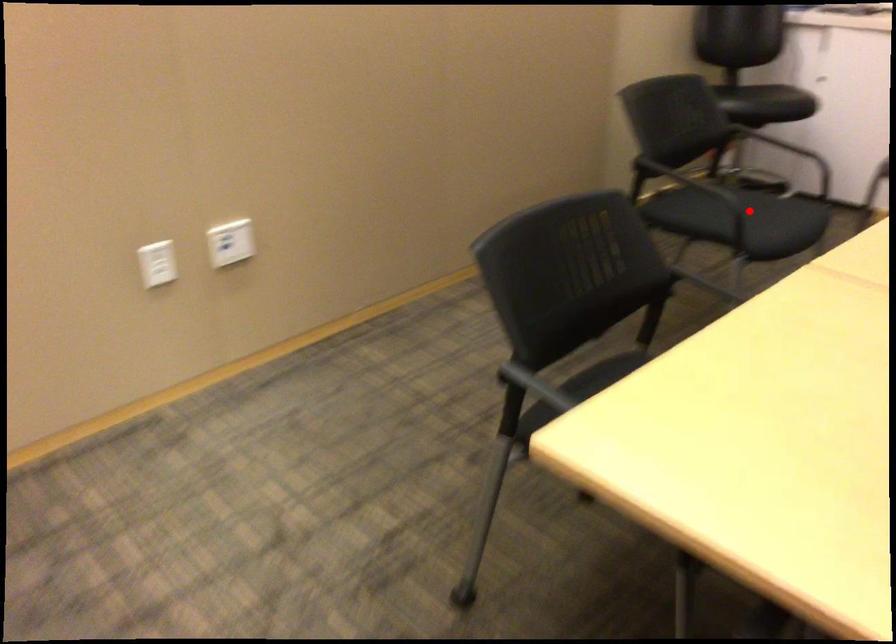
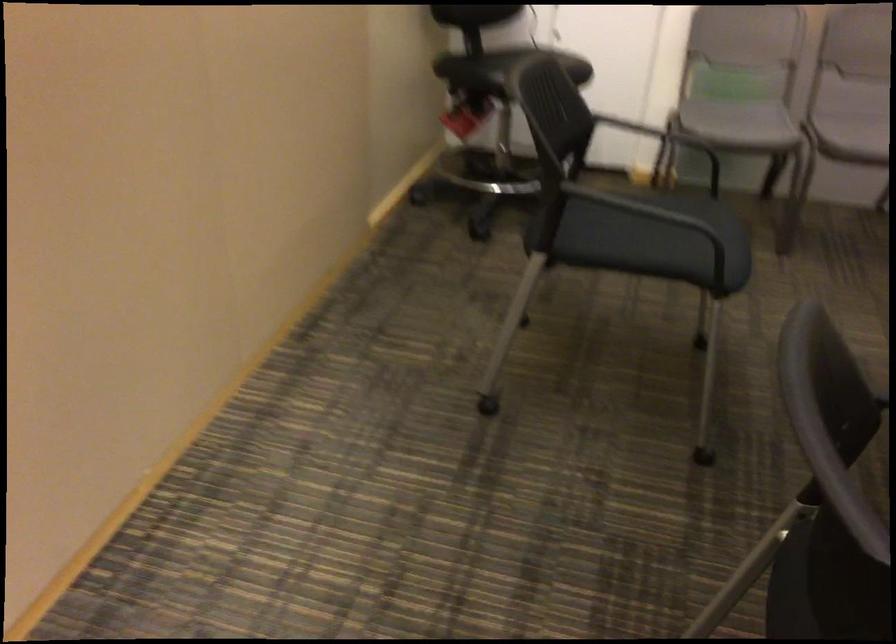
Question: I am providing you with two images of the same scene from different viewpoints. In image1, a red point is highlighted. Considering the same 3D point in image2, which of the following is correct?

Choices:
 (A) It is closer
 (B) It is farther

Answer: (A)